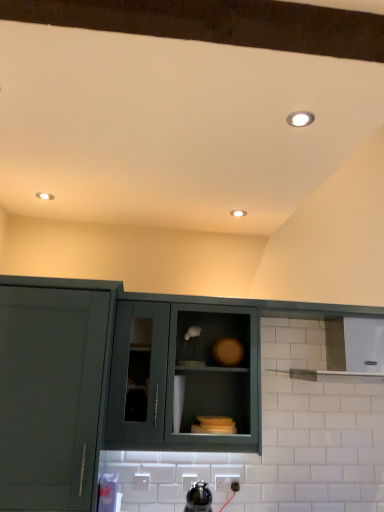
Question: Would you say matte green cabinet at center, the second cabinetry from the right, is to the left or to the right of matte green cabinet at center, arranged as the 3th cabinetry when viewed from the left, in the picture?

Choices:
 (A) left
 (B) right

Answer: (A)

Question: Based on their sizes in the image, would you say matte green cabinet at center, the second cabinetry from the right, is bigger or smaller than matte green cabinet at center, the 1th cabinetry in the right-to-left sequence?

Choices:
 (A) big
 (B) small

Answer: (A)

Question: Based on their relative distances, which object is farther from the matte white recessed light at center?

Choices:
 (A) matte green cabinet at center, arranged as the 3th cabinetry when viewed from the left
 (B) white glossy light fixture at upper right
 (C) matte green cabinet at left, the third cabinetry viewed from the right
 (D) matte green cabinet at center, the second cabinetry in the left-to-right sequence
 (E) white plastic electric outlet at lower center

Answer: (E)

Question: Which of these objects is positioned closest to the matte white recessed light at center?

Choices:
 (A) white glossy light fixture at upper right
 (B) white plastic electric outlet at lower center
 (C) matte green cabinet at left, the third cabinetry viewed from the right
 (D) matte green cabinet at center, the second cabinetry from the right
 (E) matte green cabinet at center, the 1th cabinetry in the right-to-left sequence

Answer: (A)